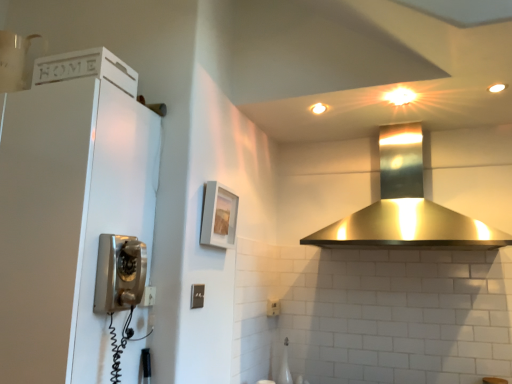
Question: Is matte gray picture frame at center taller or shorter than satin silver light switch at center?

Choices:
 (A) short
 (B) tall

Answer: (B)

Question: Is matte gray picture frame at center inside the boundaries of satin silver light switch at center, or outside?

Choices:
 (A) outside
 (B) inside

Answer: (A)

Question: Considering the real-world distances, which object is closest to the satin silver light switch at center?

Choices:
 (A) matte gray picture frame at center
 (B) white matte cabinet at left
 (C) polished stainless steel range hood at upper center

Answer: (A)

Question: Which object is the farthest from the white matte cabinet at left?

Choices:
 (A) matte gray picture frame at center
 (B) satin silver light switch at center
 (C) polished stainless steel range hood at upper center

Answer: (C)